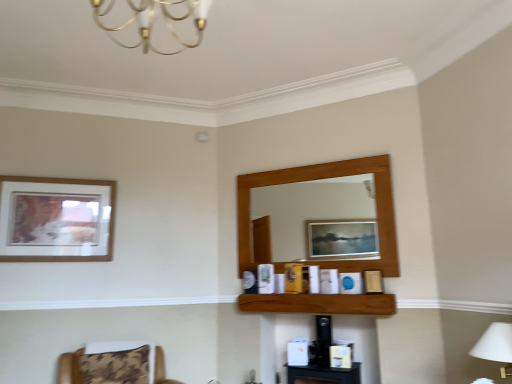
Image resolution: width=512 pixels, height=384 pixels. Find the location of `blank space situated above wooden picture frame at upper left (from a real-world perspective)`. blank space situated above wooden picture frame at upper left (from a real-world perspective) is located at coordinates pos(57,172).